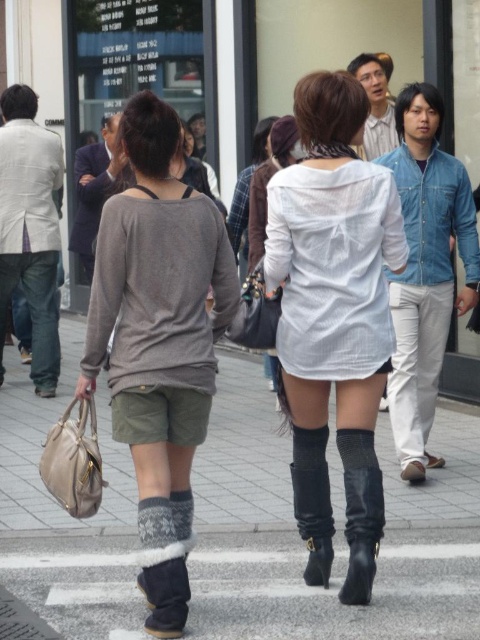
Question: Does white textured shirt at center appear over black leather boot at center?

Choices:
 (A) yes
 (B) no

Answer: (A)

Question: Is gray concrete pavement at center wider than black leather boot at center?

Choices:
 (A) yes
 (B) no

Answer: (A)

Question: Which point is farther from the camera taking this photo?

Choices:
 (A) (191, 307)
 (B) (359, 496)
 (C) (323, 552)

Answer: (C)

Question: Which point appears farthest from the camera in this image?

Choices:
 (A) (317, 548)
 (B) (291, 632)
 (C) (286, 456)

Answer: (C)

Question: Is black rubber boots at lower center further to camera compared to gray concrete pavement at center?

Choices:
 (A) yes
 (B) no

Answer: (B)

Question: Which point appears closest to the camera in this image?

Choices:
 (A) (365, 573)
 (B) (216, 592)
 (C) (326, 557)

Answer: (A)